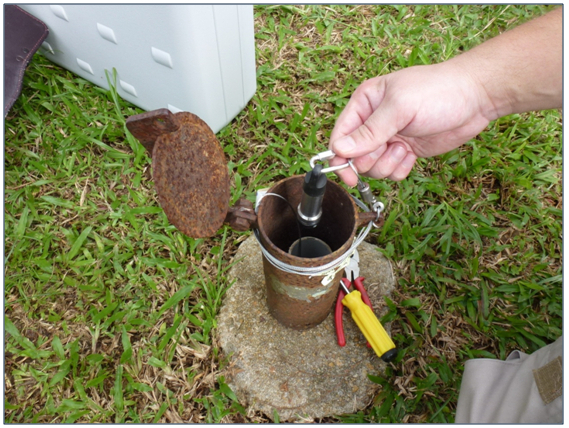
What are the coordinates of `metal cup` in the screenshot? It's located at (294, 311).